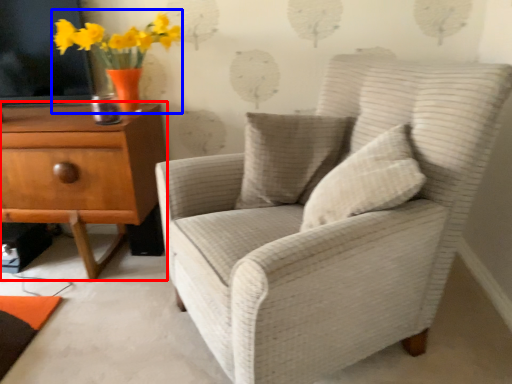
Question: Which point is further to the camera, chest of drawers (highlighted by a red box) or floral arrangement (highlighted by a blue box)?

Choices:
 (A) chest of drawers
 (B) floral arrangement

Answer: (A)